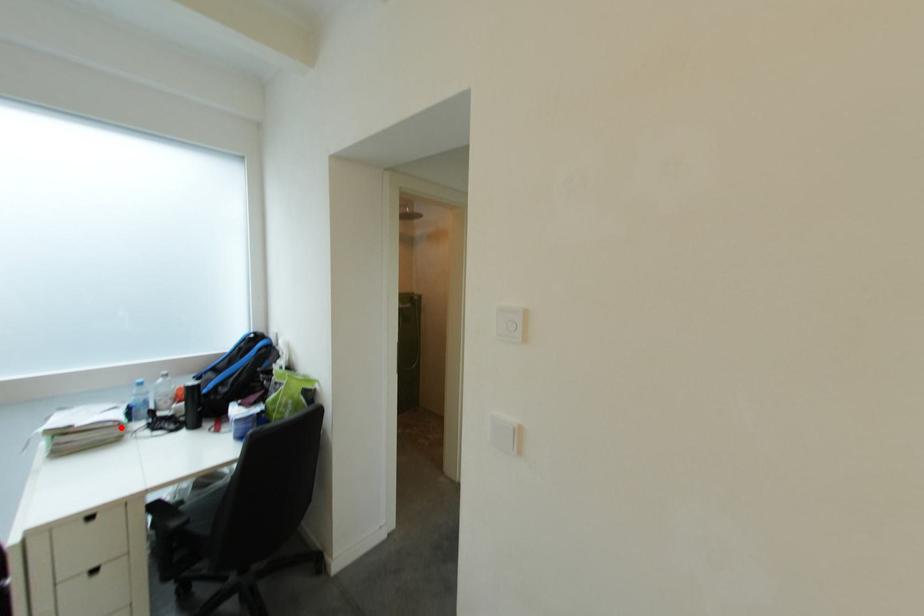
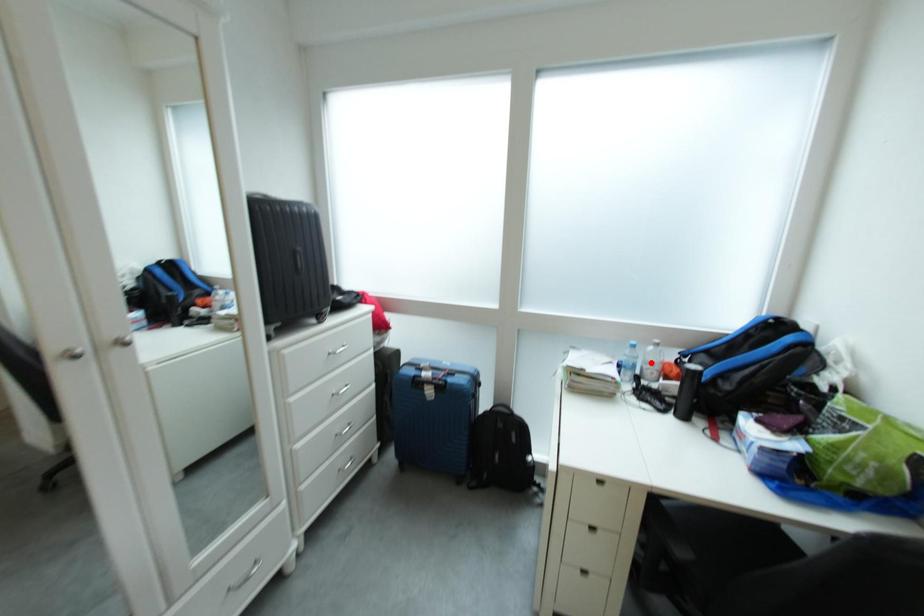
I am providing you with two images of the same scene from different viewpoints. A red point is marked on the first image and another point is marked on the second image. Are the points marked in image1 and image2 representing the same 3D position?

No